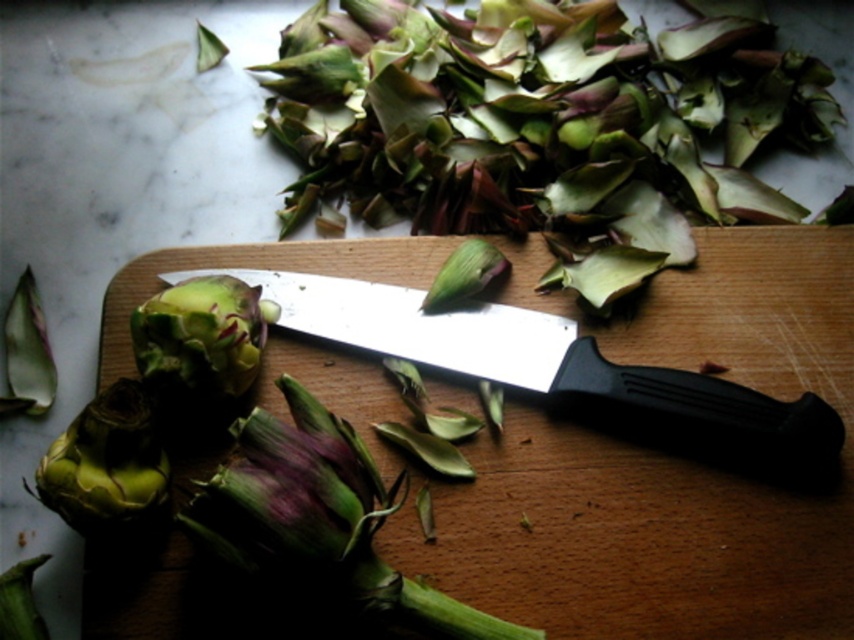
What is located at the point with coordinates (548, 364)?

The point with coordinates (548, 364) is where the black plastic knife at center is located.

You are a chef preparing a dish and need to place a 6.2 inch long ingredient between the purple matte artichoke at center and the green matte artichoke at center. Can you fit it in the space between them?

The distance between the purple matte artichoke at center and the green matte artichoke at center is 6.18 inches. Since the ingredient is 6.2 inches long, it is slightly longer than the available space. Therefore, it won